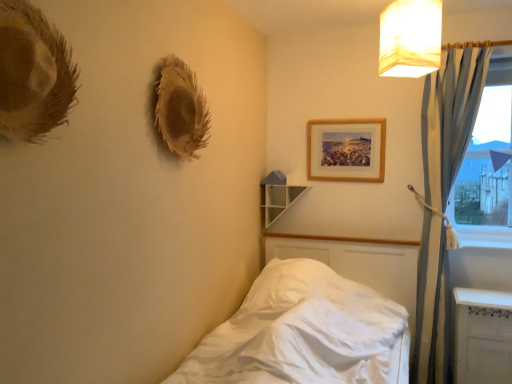
Question: Considering the positions of white satin bed at lower left and wooden picture frame at upper center in the image, is white satin bed at lower left taller or shorter than wooden picture frame at upper center?

Choices:
 (A) short
 (B) tall

Answer: (B)

Question: Considering the relative positions of white satin bed at lower left and wooden picture frame at upper center in the image provided, is white satin bed at lower left to the left or to the right of wooden picture frame at upper center?

Choices:
 (A) left
 (B) right

Answer: (A)

Question: Which of these objects is positioned farthest from the white satin bed at lower left?

Choices:
 (A) transparent glass window at right
 (B) white glossy window sill at lower right
 (C) white fabric lampshade at upper right
 (D) wooden picture frame at upper center
 (E) white glossy shelf at upper center

Answer: (C)

Question: Based on their relative distances, which object is farther from the white glossy radiator at lower right?

Choices:
 (A) wooden picture frame at upper center
 (B) transparent glass window at right
 (C) white satin bed at lower left
 (D) white glossy window sill at lower right
 (E) blue fabric curtain at right

Answer: (A)